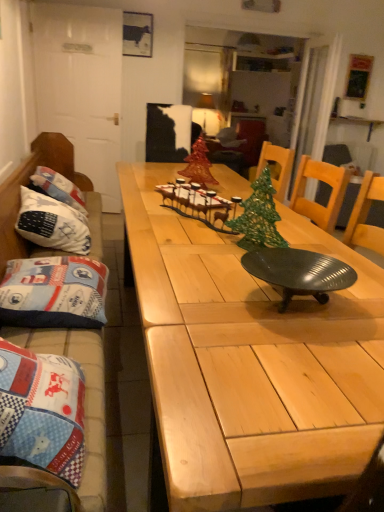
Image resolution: width=384 pixels, height=512 pixels. I want to click on blank space to the left of shiny red glass christmas tree at center, the second christmas tree from the front, so click(148, 182).